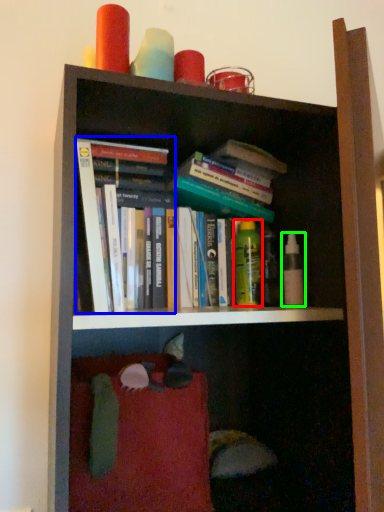
Question: Which is nearer to the toiletry (highlighted by a red box)? book (highlighted by a blue box) or toiletry (highlighted by a green box).

Choices:
 (A) book
 (B) toiletry

Answer: (B)